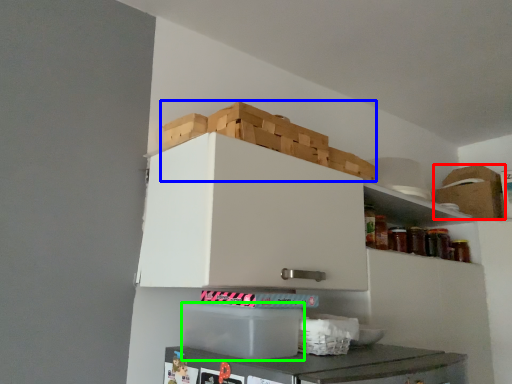
Question: Which is farther away from cardboard box (highlighted by a red box)? crate (highlighted by a blue box) or cardboard box (highlighted by a green box)?

Choices:
 (A) crate
 (B) cardboard box

Answer: (B)